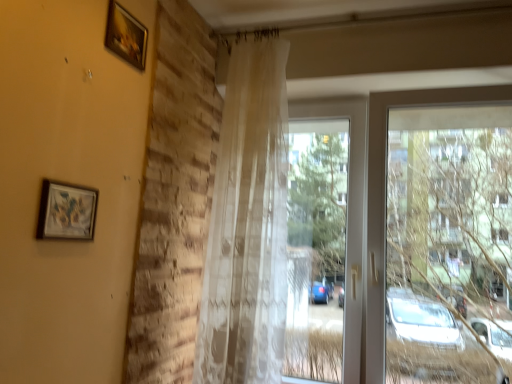
Question: Is matte wooden picture frame at upper left, arranged as the 2th picture frame when viewed from the back, facing away from transparent fabric curtain at center?

Choices:
 (A) yes
 (B) no

Answer: (B)

Question: Can you confirm if matte wooden picture frame at upper left, marked as the 1th picture frame in a front-to-back arrangement, is shorter than transparent fabric curtain at center?

Choices:
 (A) yes
 (B) no

Answer: (A)

Question: Would you consider matte wooden picture frame at upper left, the 2th picture frame from the right, to be distant from transparent fabric curtain at center?

Choices:
 (A) yes
 (B) no

Answer: (A)

Question: Can you confirm if matte wooden picture frame at upper left, marked as the first picture frame in a bottom-to-top arrangement, is taller than transparent fabric curtain at center?

Choices:
 (A) no
 (B) yes

Answer: (A)

Question: Could you tell me if matte wooden picture frame at upper left, the 2th picture frame from the right, is turned towards transparent fabric curtain at center?

Choices:
 (A) no
 (B) yes

Answer: (A)

Question: From the image's perspective, is transparent fabric curtain at center above or below translucent beige curtain at center?

Choices:
 (A) above
 (B) below

Answer: (B)

Question: Would you say transparent fabric curtain at center is to the left or to the right of translucent beige curtain at center in the picture?

Choices:
 (A) right
 (B) left

Answer: (A)

Question: In terms of size, does transparent fabric curtain at center appear bigger or smaller than translucent beige curtain at center?

Choices:
 (A) small
 (B) big

Answer: (B)

Question: Considering the positions of transparent fabric curtain at center and translucent beige curtain at center in the image, is transparent fabric curtain at center taller or shorter than translucent beige curtain at center?

Choices:
 (A) short
 (B) tall

Answer: (A)

Question: In terms of height, does translucent beige curtain at center look taller or shorter compared to wooden frame at upper left, the first picture frame from the back?

Choices:
 (A) short
 (B) tall

Answer: (B)

Question: In terms of width, does translucent beige curtain at center look wider or thinner when compared to wooden frame at upper left, the first picture frame from the back?

Choices:
 (A) wide
 (B) thin

Answer: (A)

Question: Considering the positions of point (207, 271) and point (113, 28), is point (207, 271) closer or farther from the camera than point (113, 28)?

Choices:
 (A) closer
 (B) farther

Answer: (B)

Question: Based on their sizes in the image, would you say translucent beige curtain at center is bigger or smaller than wooden frame at upper left, the second picture frame ordered from the bottom?

Choices:
 (A) small
 (B) big

Answer: (B)

Question: Considering the positions of matte wooden picture frame at upper left, marked as the first picture frame in a bottom-to-top arrangement, and transparent fabric curtain at center in the image, is matte wooden picture frame at upper left, marked as the first picture frame in a bottom-to-top arrangement, wider or thinner than transparent fabric curtain at center?

Choices:
 (A) thin
 (B) wide

Answer: (A)

Question: From a real-world perspective, is matte wooden picture frame at upper left, arranged as the 2th picture frame when viewed from the back, physically located above or below transparent fabric curtain at center?

Choices:
 (A) above
 (B) below

Answer: (B)